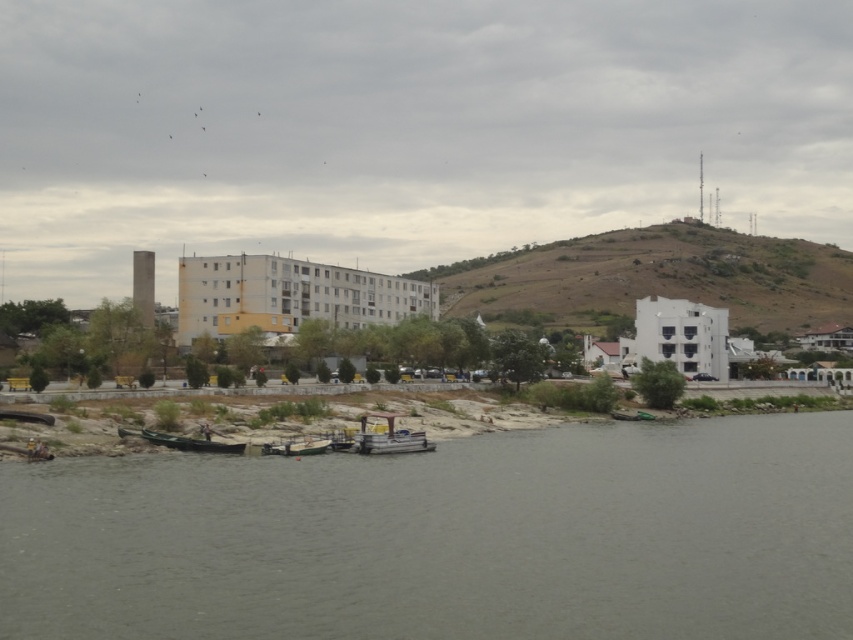
Can you confirm if gray concrete river at lower center is positioned below wooden boat at lower center?

Actually, gray concrete river at lower center is above wooden boat at lower center.

Locate an element on the screen. This screenshot has height=640, width=853. gray concrete river at lower center is located at coordinates (447, 538).

Who is more distant from viewer, (650,634) or (276,452)?

Point (276,452)

The width and height of the screenshot is (853, 640). Identify the location of gray concrete river at lower center. [447, 538].

Does point (737, 496) lie in front of point (207, 445)?

Yes, point (737, 496) is closer to viewer.

The image size is (853, 640). What do you see at coordinates (447, 538) in the screenshot?
I see `gray concrete river at lower center` at bounding box center [447, 538].

Which is behind, point (164, 616) or point (206, 442)?

The point (206, 442) is more distant.

The height and width of the screenshot is (640, 853). Find the location of `gray concrete river at lower center`. gray concrete river at lower center is located at coordinates coord(447,538).

Which is behind, point (204, 442) or point (308, 452)?

The point (204, 442) is more distant.

Who is positioned more to the left, green matte boat at lower left or wooden boat at lower center?

green matte boat at lower left

Does point (157, 442) come closer to viewer compared to point (302, 444)?

Yes, point (157, 442) is in front of point (302, 444).

Find the location of a particular element. This screenshot has width=853, height=640. green matte boat at lower left is located at coordinates (190, 442).